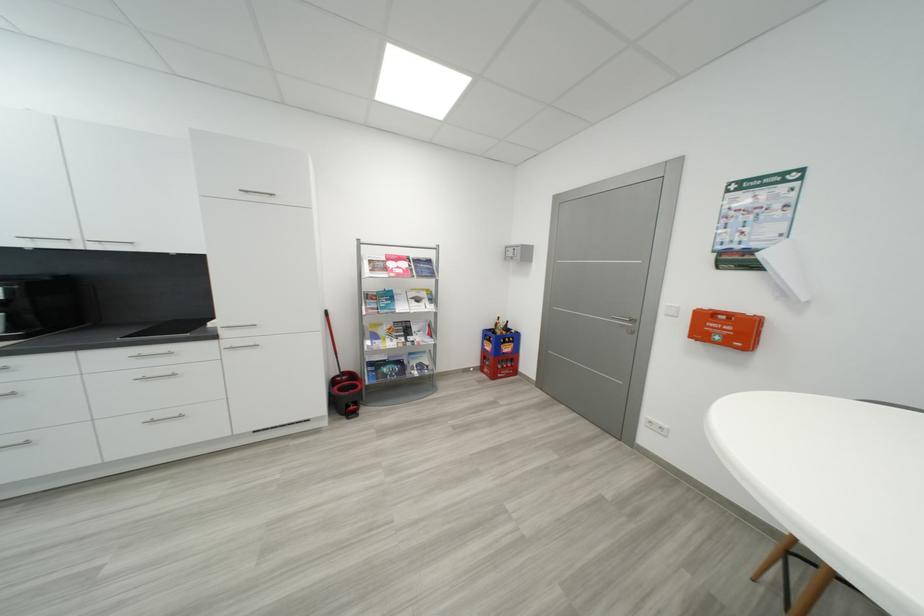
What do you see at coordinates (630, 323) in the screenshot? Image resolution: width=924 pixels, height=616 pixels. I see `a silver door handle` at bounding box center [630, 323].